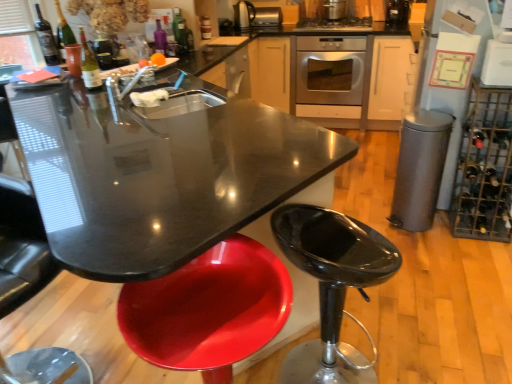
What are the coordinates of `free location in front of metallic wire wine rack at right` in the screenshot? It's located at (480, 262).